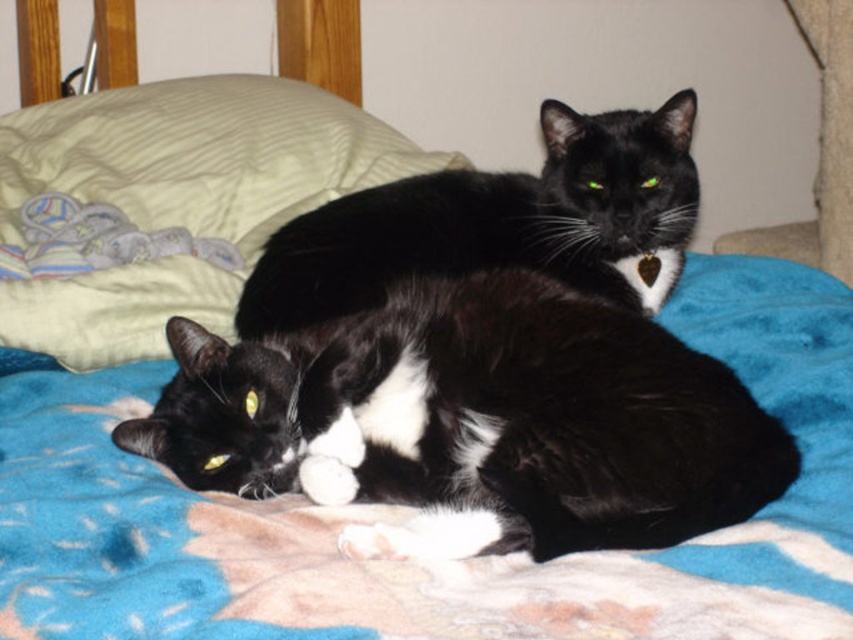
Can you confirm if black/white fur cat at lower left is thinner than light green quilted pillow at upper left?

Correct, black/white fur cat at lower left's width is less than light green quilted pillow at upper left's.

Where is `black/white fur cat at lower left`? black/white fur cat at lower left is located at coordinates (474, 422).

Between light green quilted pillow at upper left and black glossy cat at upper center, which one appears on the left side from the viewer's perspective?

light green quilted pillow at upper left

Between point (213, 172) and point (677, 125), which one is positioned in front?

Point (677, 125) is more forward.

You are a GUI agent. You are given a task and a screenshot of the screen. Output one action in this format:
    pyautogui.click(x=<x>, y=<y>)
    Task: Click on the light green quilted pillow at upper left
    
    Given the screenshot: What is the action you would take?
    175,198

Between black/white fur cat at lower left and black glossy cat at upper center, which one is positioned higher?

black glossy cat at upper center

Is black/white fur cat at lower left wider than black glossy cat at upper center?

No.

Which is in front, point (199, 355) or point (650, 196)?

Positioned in front is point (199, 355).

Where is `black/white fur cat at lower left`? black/white fur cat at lower left is located at coordinates (474, 422).